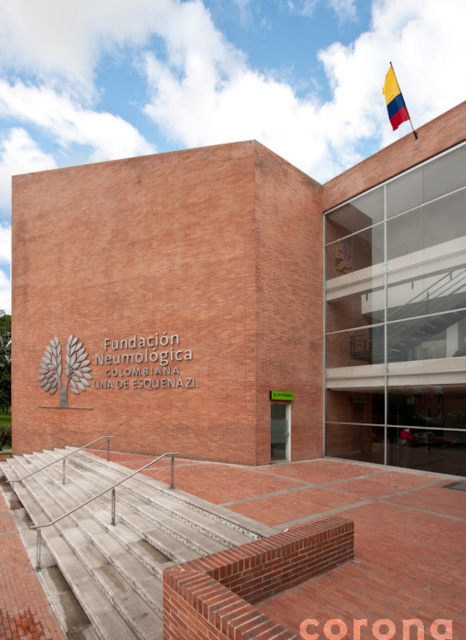
Between concrete steps at lower left and red fabric flag at upper right, which one appears on the left side from the viewer's perspective?

concrete steps at lower left

Which of these two, concrete steps at lower left or red fabric flag at upper right, stands taller?

red fabric flag at upper right is taller.

Between point (109, 548) and point (397, 93), which one is positioned in front?

Point (109, 548) is in front.

The height and width of the screenshot is (640, 466). I want to click on concrete steps at lower left, so click(137, 552).